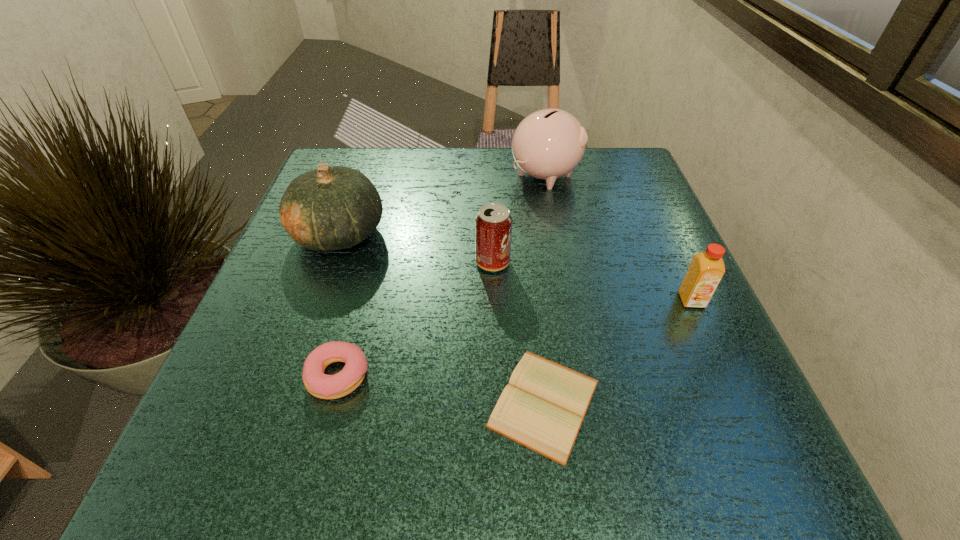
You are a GUI agent. You are given a task and a screenshot of the screen. Output one action in this format:
    pyautogui.click(x=<x>, y=<y>)
    Task: Click on the vacant space located 0.290m on the right of the soda can
    This screenshot has height=540, width=960.
    Given the screenshot: What is the action you would take?
    pyautogui.click(x=663, y=262)

I want to click on vacant space situated 0.240m on the right of the fifth tallest object, so click(530, 376).

Locate an element on the screen. The height and width of the screenshot is (540, 960). vacant space located on the left of the diary is located at coordinates (231, 403).

Find the location of a particular element. The height and width of the screenshot is (540, 960). object that is at the far edge is located at coordinates (549, 143).

Identify the location of object at the near edge. Image resolution: width=960 pixels, height=540 pixels. (542, 408).

Locate an element on the screen. The image size is (960, 540). gourd that is at the left edge is located at coordinates (329, 208).

I want to click on doughnut that is positioned at the left edge, so [x=318, y=384].

Identify the location of piggy bank positioned at the right edge. This screenshot has width=960, height=540. (549, 143).

The width and height of the screenshot is (960, 540). In order to click on orange juice positioned at the right edge in this screenshot , I will do `click(706, 270)`.

Identify the location of object present at the far right corner. (549, 143).